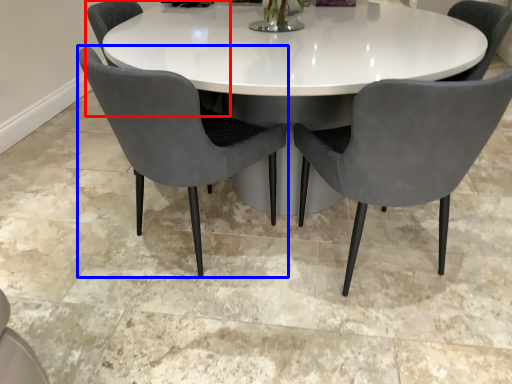
Question: Which of the following is the closest to the observer, chair (highlighted by a red box) or chair (highlighted by a blue box)?

Choices:
 (A) chair
 (B) chair

Answer: (B)